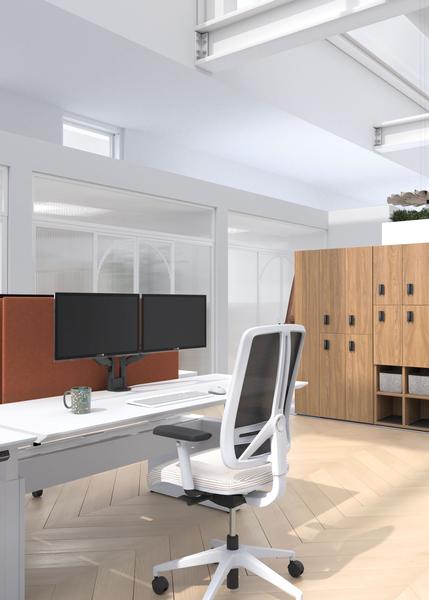
Image resolution: width=429 pixels, height=600 pixels. Find the location of `office chair`. office chair is located at coordinates (256, 393).